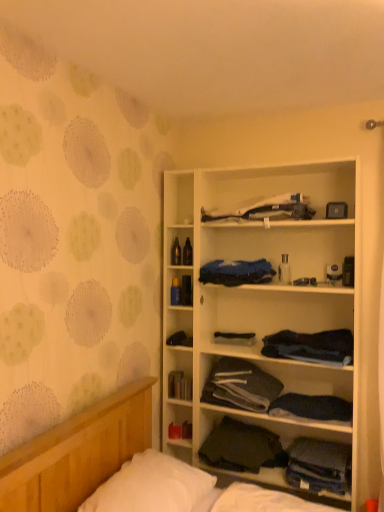
Question: From the image's perspective, is dark gray fabric at center, the seventh clothing viewed from the top, below white soft pillow at lower left?

Choices:
 (A) yes
 (B) no

Answer: (A)

Question: Is dark gray fabric at center, positioned as the second clothing in bottom-to-top order, oriented away from white soft pillow at lower left?

Choices:
 (A) yes
 (B) no

Answer: (B)

Question: Is dark gray fabric at center, positioned as the second clothing in bottom-to-top order, at the right side of white soft pillow at lower left?

Choices:
 (A) yes
 (B) no

Answer: (A)

Question: Are dark gray fabric at center, the seventh clothing viewed from the top, and white soft pillow at lower left making contact?

Choices:
 (A) no
 (B) yes

Answer: (A)

Question: In terms of height, does white wood cabinet at center look taller or shorter compared to dark blue fabric at center, which appears as the sixth clothing when viewed from the top?

Choices:
 (A) tall
 (B) short

Answer: (A)

Question: Is white wood cabinet at center wider or thinner than dark blue fabric at center, which appears as the sixth clothing when viewed from the top?

Choices:
 (A) thin
 (B) wide

Answer: (B)

Question: From a real-world perspective, is white wood cabinet at center above or below dark blue fabric at center, which ranks as the third clothing in bottom-to-top order?

Choices:
 (A) above
 (B) below

Answer: (A)

Question: In the image, is white wood cabinet at center positioned in front of or behind dark blue fabric at center, which appears as the sixth clothing when viewed from the top?

Choices:
 (A) front
 (B) behind

Answer: (A)

Question: Looking at the image, does dark gray fabric at center, the eighth clothing when ordered from top to bottom, seem bigger or smaller compared to dark blue fabric at center, acting as the seventh clothing starting from the bottom?

Choices:
 (A) small
 (B) big

Answer: (A)

Question: Does point click(332, 466) appear closer or farther from the camera than point click(246, 280)?

Choices:
 (A) closer
 (B) farther

Answer: (A)

Question: From their relative heights in the image, would you say dark gray fabric at center, which is the first clothing in bottom-to-top order, is taller or shorter than dark blue fabric at center, which is the second clothing in top-to-bottom order?

Choices:
 (A) short
 (B) tall

Answer: (B)

Question: From the image's perspective, is dark gray fabric at center, the eighth clothing when ordered from top to bottom, above or below dark blue fabric at center, which is the second clothing in top-to-bottom order?

Choices:
 (A) above
 (B) below

Answer: (B)

Question: From a real-world perspective, is matte black book at center positioned above or below white soft pillow at lower left?

Choices:
 (A) above
 (B) below

Answer: (A)

Question: Considering their positions, is matte black book at center located in front of or behind white soft pillow at lower left?

Choices:
 (A) behind
 (B) front

Answer: (A)